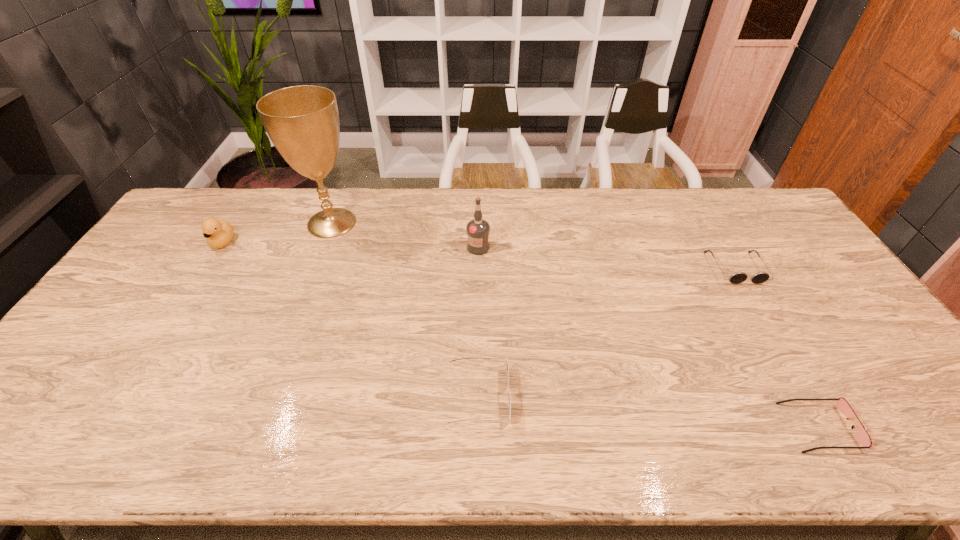
I want to click on free space located 0.110m on the front-facing side of the farthest sunglasses, so click(762, 314).

Locate an element on the screen. vacant space located 0.320m on the front-facing side of the leftmost sunglasses is located at coordinates (642, 396).

You are a GUI agent. You are given a task and a screenshot of the screen. Output one action in this format:
    pyautogui.click(x=<x>, y=<y>)
    Task: Click on the object present at the far edge
    This screenshot has height=540, width=960.
    Given the screenshot: What is the action you would take?
    pyautogui.click(x=302, y=122)

Identify the location of vacant space at the far edge of the desktop. (634, 221).

At what (x,y) coordinates should I click in order to perform the action: click on vacant area at the near edge. Please return your answer as a coordinate pair (x, y). Looking at the image, I should click on (721, 443).

The height and width of the screenshot is (540, 960). I want to click on vacant space at the left edge of the desktop, so click(x=99, y=393).

Where is `free region at the right edge of the desktop`? Image resolution: width=960 pixels, height=540 pixels. free region at the right edge of the desktop is located at coordinates (833, 313).

This screenshot has width=960, height=540. What are the coordinates of `empty space between the fifth shortest object and the leftmost object` in the screenshot? It's located at (350, 245).

Find the location of a particular element. The width and height of the screenshot is (960, 540). vacant area that lies between the leftmost sunglasses and the farthest sunglasses is located at coordinates (607, 332).

Image resolution: width=960 pixels, height=540 pixels. What are the coordinates of `free space between the vodka and the leftmost sunglasses` in the screenshot? It's located at (478, 322).